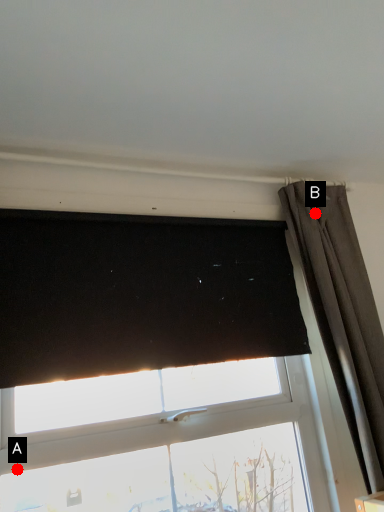
Question: Two points are circled on the image, labeled by A and B beside each circle. Which of the following is the farthest from the observer?

Choices:
 (A) A is further
 (B) B is further

Answer: (B)